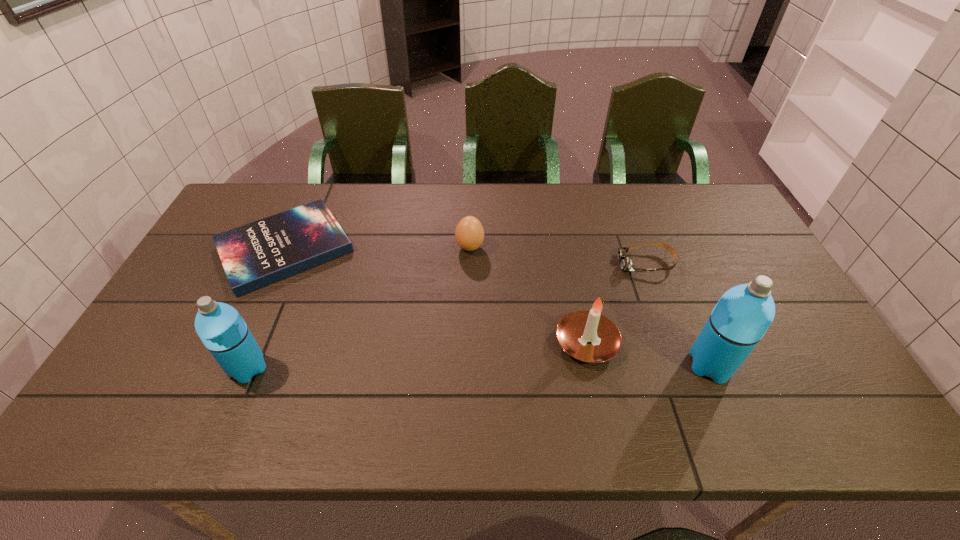
Identify the location of vacant space located 0.380m on the right of the left thermos bottle. The width and height of the screenshot is (960, 540). (423, 368).

The height and width of the screenshot is (540, 960). Identify the location of free space located 0.300m on the back of the tallest object. (667, 264).

Identify the location of free region located on the front-facing side of the goggles. The image size is (960, 540). (546, 264).

Identify the location of vacant area situated on the front-facing side of the goggles. This screenshot has width=960, height=540. (583, 264).

At what (x,y) coordinates should I click in order to perform the action: click on free spot located 0.220m on the front-facing side of the goggles. Please return your answer as a coordinate pair (x, y). The height and width of the screenshot is (540, 960). Looking at the image, I should click on (546, 264).

This screenshot has height=540, width=960. What are the coordinates of `blank area located 0.380m on the front of the third object from left to right` in the screenshot? It's located at (468, 364).

I want to click on vacant region located 0.160m on the front of the hardback book, so click(x=241, y=345).

Find the location of `free space located 0.390m on the right of the fourth shortest object`. free space located 0.390m on the right of the fourth shortest object is located at coordinates (771, 342).

Locate an element on the screen. Image resolution: width=960 pixels, height=540 pixels. object that is at the far edge is located at coordinates (254, 255).

This screenshot has height=540, width=960. What are the coordinates of `candle at the near edge` in the screenshot? It's located at (588, 336).